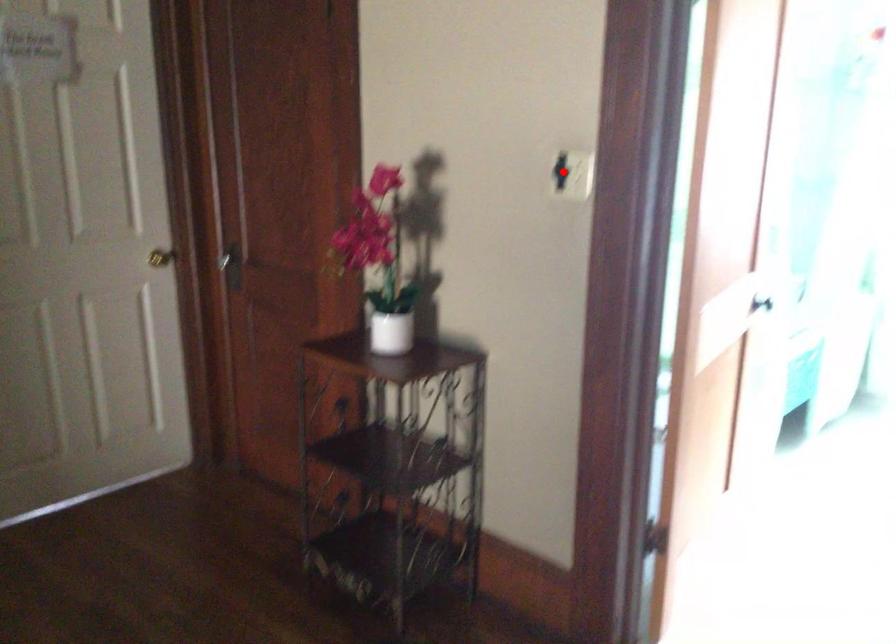
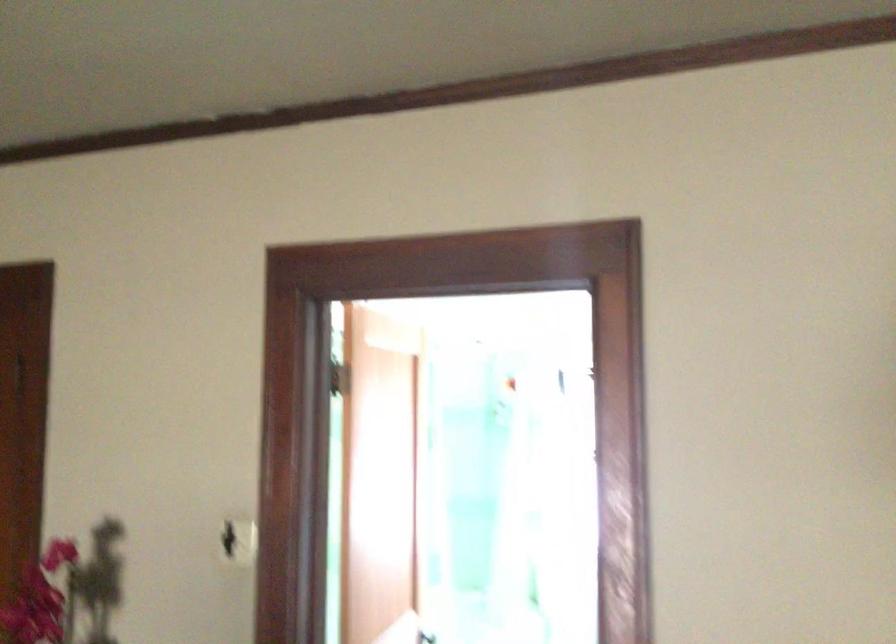
Where in the second image is the point corresponding to the highlighted location from the first image?

(228, 540)